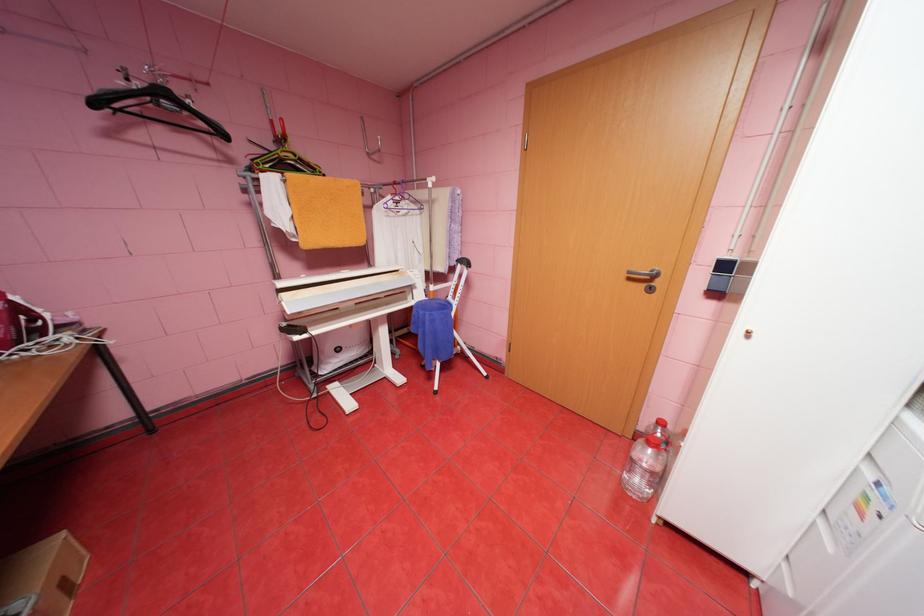
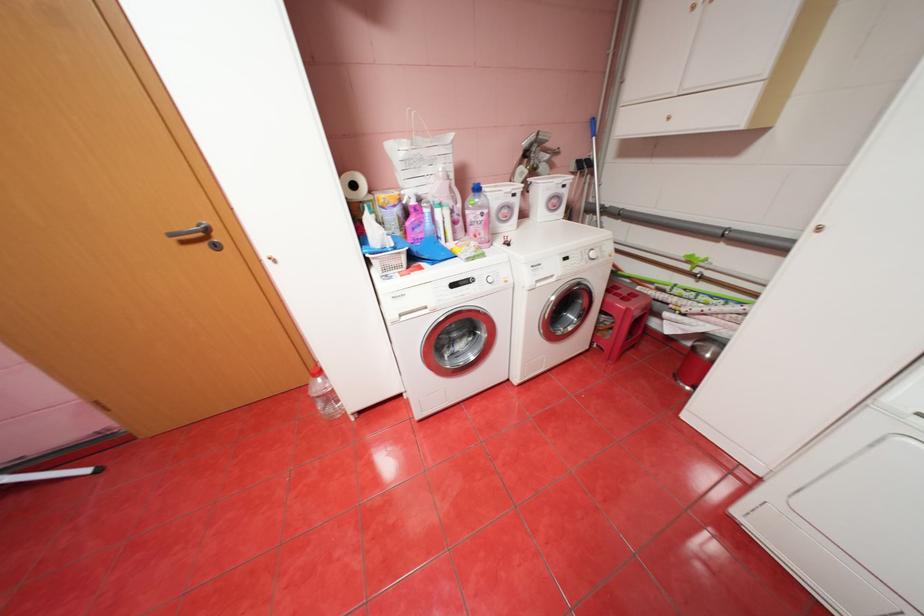
How did the camera likely rotate?

The camera's rotation is toward right-down.